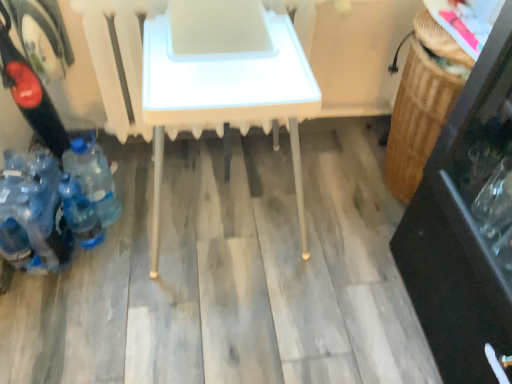
Question: Considering the positions of point (88, 240) and point (143, 104), is point (88, 240) closer or farther from the camera than point (143, 104)?

Choices:
 (A) farther
 (B) closer

Answer: (A)

Question: From the image's perspective, is blue plastic bottle at lower left, the 2th bottle positioned from the right, located above or below white plastic table at center?

Choices:
 (A) below
 (B) above

Answer: (A)

Question: Which is nearer to the blue plastic bottle at lower left, which is counted as the second bottle, starting from the left?

Choices:
 (A) white plastic table at center
 (B) blue plastic bottle at lower left, arranged as the first bottle when viewed from the right
 (C) blue plastic bottles at lower left, the first bottle in the left-to-right sequence

Answer: (C)

Question: Which object is positioned closest to the white plastic table at center?

Choices:
 (A) blue plastic bottles at lower left, the first bottle in the left-to-right sequence
 (B) blue plastic bottle at lower left, the 3th bottle positioned from the left
 (C) blue plastic bottle at lower left, which is counted as the second bottle, starting from the left

Answer: (A)